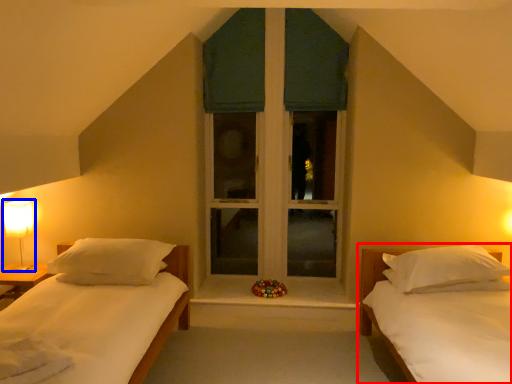
Question: Which object is closer to the camera taking this photo, bed (highlighted by a red box) or table lamp (highlighted by a blue box)?

Choices:
 (A) bed
 (B) table lamp

Answer: (A)